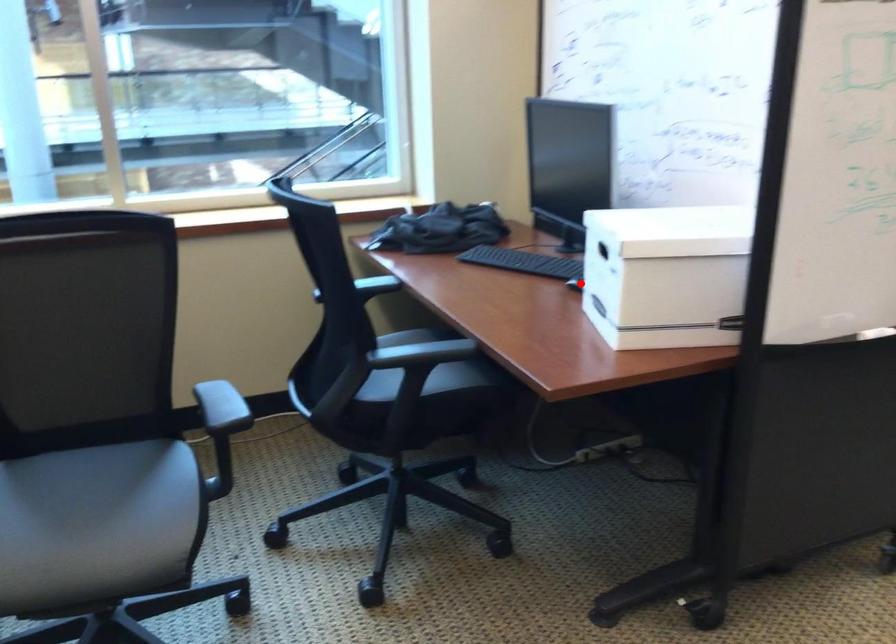
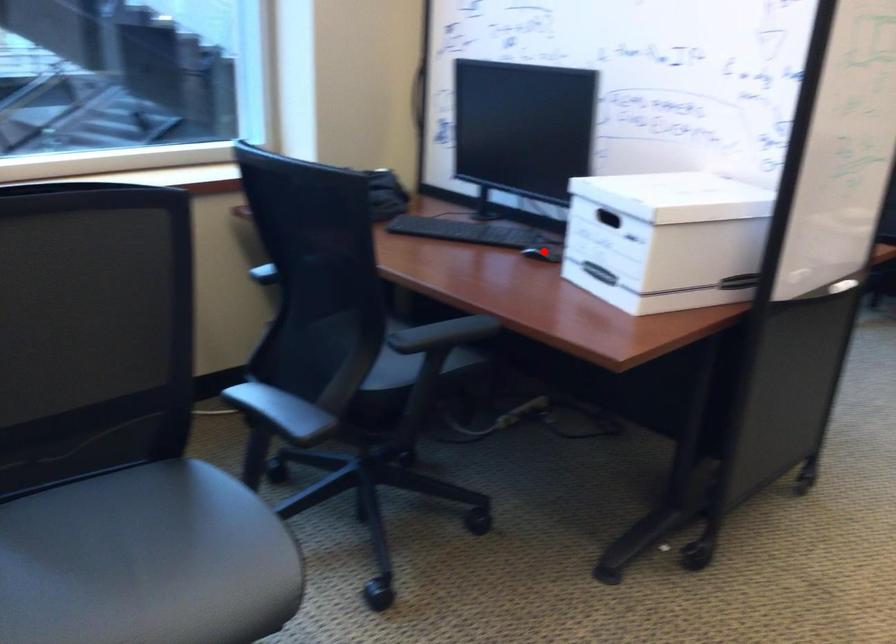
I am providing you with two images of the same scene from different viewpoints. A red point is marked on the first image and another point is marked on the second image. Do the highlighted points in image1 and image2 indicate the same real-world spot?

Yes